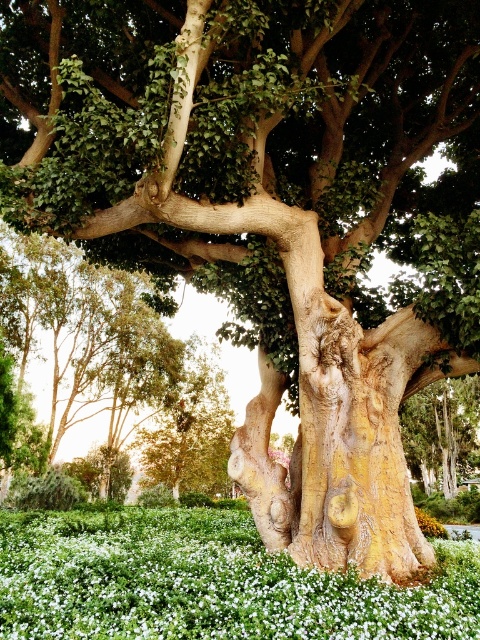
Question: Can you confirm if white matte flower at center is positioned to the right of yellow matte flower at center?

Choices:
 (A) yes
 (B) no

Answer: (B)

Question: From the image, what is the correct spatial relationship of white matte flower at center in relation to yellow matte flower at center?

Choices:
 (A) right
 (B) left

Answer: (B)

Question: Considering the relative positions of white matte flower at center and yellow matte flower at center in the image provided, where is white matte flower at center located with respect to yellow matte flower at center?

Choices:
 (A) above
 (B) below

Answer: (A)

Question: Among these points, which one is nearest to the camera?

Choices:
 (A) (425, 525)
 (B) (222, 586)

Answer: (B)

Question: Among these objects, which one is nearest to the camera?

Choices:
 (A) yellow matte flower at center
 (B) white matte flower at center

Answer: (B)